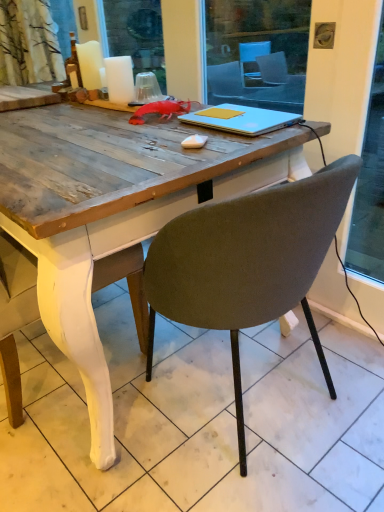
You are a GUI agent. You are given a task and a screenshot of the screen. Output one action in this format:
    pyautogui.click(x=<x>, y=<y>)
    Task: Click on the white matte candle at upper left, which is the 1th candle from front to back
    The height and width of the screenshot is (512, 384).
    Given the screenshot: What is the action you would take?
    pyautogui.click(x=119, y=79)

Measure the distance between white matte candle at upper left, the second candle from the front, and camera.

6.25 feet.

The width and height of the screenshot is (384, 512). Identify the location of silver metallic laptop at center, the 1th notebook in the bottom-to-top sequence. (241, 119).

Between matte gray chair at center and white matte candle at upper left, placed as the 2th candle when sorted from left to right, which one has larger size?

matte gray chair at center is bigger.

Which object is closer to the camera, matte gray chair at center or white matte candle at upper left, placed as the 2th candle when sorted from left to right?

Positioned in front is matte gray chair at center.

Does matte gray chair at center appear on the right side of white matte candle at upper left, which is the 1th candle from front to back?

Yes, matte gray chair at center is to the right of white matte candle at upper left, which is the 1th candle from front to back.

From a real-world perspective, is matte gray chair at center positioned above or below white matte candle at upper left, which is the 1th candle from front to back?

From a real-world perspective, matte gray chair at center is physically below white matte candle at upper left, which is the 1th candle from front to back.

Considering the points (92, 57) and (297, 181), which point is behind, point (92, 57) or point (297, 181)?

Positioned behind is point (92, 57).

Is matte gray chair at center a part of white matte candle at upper left, the second candle from the front?

No, matte gray chair at center is not a part of white matte candle at upper left, the second candle from the front.

How distant is white matte candle at upper left, arranged as the 2th candle when viewed from the right, from matte gray chair at center?

A distance of 4.50 feet exists between white matte candle at upper left, arranged as the 2th candle when viewed from the right, and matte gray chair at center.

From the image's perspective, is white matte candle at upper left, which appears as the 1th candle when viewed from the left, above or below matte gray chair at center?

Clearly, from the image's perspective, white matte candle at upper left, which appears as the 1th candle when viewed from the left, is above matte gray chair at center.

Looking at this image, can you confirm if matte gray chair at center is wider than silver metallic laptop at center, the 1th notebook in the bottom-to-top sequence?

Correct, the width of matte gray chair at center exceeds that of silver metallic laptop at center, the 1th notebook in the bottom-to-top sequence.

Can you tell me how much matte gray chair at center and silver metallic laptop at center, marked as the 2th notebook in a top-to-bottom arrangement, differ in facing direction?

90 degrees separate the facing orientations of matte gray chair at center and silver metallic laptop at center, marked as the 2th notebook in a top-to-bottom arrangement.

Where is `notebook that is the 1st object located above the matte gray chair at center (from the image's perspective)`? The height and width of the screenshot is (512, 384). notebook that is the 1st object located above the matte gray chair at center (from the image's perspective) is located at coordinates tap(241, 119).

Would you say silver metallic laptop at center, marked as the 2th notebook in a top-to-bottom arrangement, is part of matte gray chair at center's contents?

Indeed, silver metallic laptop at center, marked as the 2th notebook in a top-to-bottom arrangement, is located within matte gray chair at center.

Is yellow matte notebook at center, the first notebook when ordered from top to bottom, located outside silver metallic laptop at center, the 1th notebook in the bottom-to-top sequence?

No, yellow matte notebook at center, the first notebook when ordered from top to bottom, is not entirely external to silver metallic laptop at center, the 1th notebook in the bottom-to-top sequence.

In the scene shown: Is yellow matte notebook at center, which is the 2th notebook from bottom to top, at the left side of silver metallic laptop at center, marked as the 2th notebook in a top-to-bottom arrangement?

Correct, you'll find yellow matte notebook at center, which is the 2th notebook from bottom to top, to the left of silver metallic laptop at center, marked as the 2th notebook in a top-to-bottom arrangement.

At what (x,y) coordinates should I click in order to perform the action: click on notebook lying on the right of yellow matte notebook at center, which is the 2th notebook from bottom to top. Please return your answer as a coordinate pair (x, y). Looking at the image, I should click on (241, 119).

Which object is wider, yellow matte notebook at center, the first notebook when ordered from top to bottom, or silver metallic laptop at center, the 1th notebook in the bottom-to-top sequence?

silver metallic laptop at center, the 1th notebook in the bottom-to-top sequence, is wider.

Considering the sizes of objects matte gray chair at center and yellow matte notebook at center, which is the 2th notebook from bottom to top, in the image provided, who is shorter, matte gray chair at center or yellow matte notebook at center, which is the 2th notebook from bottom to top,?

yellow matte notebook at center, which is the 2th notebook from bottom to top.

Is matte gray chair at center at the left side of yellow matte notebook at center, which is the 2th notebook from bottom to top?

No.

Where is `chair in front of the yellow matte notebook at center, the first notebook when ordered from top to bottom`? This screenshot has height=512, width=384. chair in front of the yellow matte notebook at center, the first notebook when ordered from top to bottom is located at coordinates (247, 262).

Does silver metallic laptop at center, the 1th notebook in the bottom-to-top sequence, come behind white matte candle at upper left, which is the first candle from right to left?

No, silver metallic laptop at center, the 1th notebook in the bottom-to-top sequence, is closer to the camera.

From the image's perspective, who appears lower, silver metallic laptop at center, the 1th notebook in the bottom-to-top sequence, or white matte candle at upper left, placed as the 2th candle when sorted from left to right?

From the image's view, silver metallic laptop at center, the 1th notebook in the bottom-to-top sequence, is below.

From a real-world perspective, is silver metallic laptop at center, the 1th notebook in the bottom-to-top sequence, over white matte candle at upper left, the 2th candle when ordered from back to front?

No, from a real-world perspective, silver metallic laptop at center, the 1th notebook in the bottom-to-top sequence, is not on top of white matte candle at upper left, the 2th candle when ordered from back to front.

Is white matte candle at upper left, which is the 1th candle from front to back, not close to silver metallic laptop at center, marked as the 2th notebook in a top-to-bottom arrangement?

Actually, white matte candle at upper left, which is the 1th candle from front to back, and silver metallic laptop at center, marked as the 2th notebook in a top-to-bottom arrangement, are a little close together.

Considering the relative sizes of white matte candle at upper left, the 2th candle when ordered from back to front, and silver metallic laptop at center, marked as the 2th notebook in a top-to-bottom arrangement, in the image provided, is white matte candle at upper left, the 2th candle when ordered from back to front, thinner than silver metallic laptop at center, marked as the 2th notebook in a top-to-bottom arrangement,?

Correct, the width of white matte candle at upper left, the 2th candle when ordered from back to front, is less than that of silver metallic laptop at center, marked as the 2th notebook in a top-to-bottom arrangement.

Locate an element on the screen. the 1st candle counting from the left of the silver metallic laptop at center, the 1th notebook in the bottom-to-top sequence is located at coordinates (119, 79).

Is silver metallic laptop at center, marked as the 2th notebook in a top-to-bottom arrangement, at the back of white matte candle at upper left, the 2th candle when ordered from back to front?

white matte candle at upper left, the 2th candle when ordered from back to front, does not have its back to silver metallic laptop at center, marked as the 2th notebook in a top-to-bottom arrangement.

This screenshot has width=384, height=512. What are the coordinates of `chair in front of the white matte candle at upper left, placed as the 2th candle when sorted from left to right` in the screenshot? It's located at (247, 262).

Identify the location of chair on the right of white matte candle at upper left, arranged as the 2th candle when viewed from the right. The height and width of the screenshot is (512, 384). (247, 262).

Looking at the image, which one is located closer to matte gray chair at center, white matte candle at upper left, the second candle from the front, or yellow matte notebook at center, which is the 2th notebook from bottom to top?

yellow matte notebook at center, which is the 2th notebook from bottom to top, is positioned closer to the anchor matte gray chair at center.

Estimate the real-world distances between objects in this image. Which object is closer to matte gray chair at center, white matte candle at upper left, which is the first candle from right to left, or silver metallic laptop at center, the 1th notebook in the bottom-to-top sequence?

silver metallic laptop at center, the 1th notebook in the bottom-to-top sequence, is positioned closer to the anchor matte gray chair at center.

From the image, which object appears to be nearer to yellow matte notebook at center, which is the 2th notebook from bottom to top, matte gray chair at center or white matte candle at upper left, which is the 1th candle from front to back?

white matte candle at upper left, which is the 1th candle from front to back, lies closer to yellow matte notebook at center, which is the 2th notebook from bottom to top, than the other object.

From the image, which object appears to be farther from yellow matte notebook at center, the first notebook when ordered from top to bottom, silver metallic laptop at center, marked as the 2th notebook in a top-to-bottom arrangement, or white matte candle at upper left, which is the first candle from right to left?

The object further to yellow matte notebook at center, the first notebook when ordered from top to bottom, is white matte candle at upper left, which is the first candle from right to left.

Estimate the real-world distances between objects in this image. Which object is closer to silver metallic laptop at center, the 1th notebook in the bottom-to-top sequence, matte gray chair at center or white matte candle at upper left, the second candle from the front?

Based on the image, matte gray chair at center appears to be nearer to silver metallic laptop at center, the 1th notebook in the bottom-to-top sequence.

Based on the photo, based on their spatial positions, is matte gray chair at center or silver metallic laptop at center, marked as the 2th notebook in a top-to-bottom arrangement, further from white matte candle at upper left, which is the first candle from right to left?

matte gray chair at center lies further to white matte candle at upper left, which is the first candle from right to left, than the other object.

Looking at this image, which object lies further to the anchor point silver metallic laptop at center, the 1th notebook in the bottom-to-top sequence, white matte candle at upper left, which is the first candle from right to left, or white matte candle at upper left, which ranks as the 1th candle in back-to-front order?

Among the two, white matte candle at upper left, which ranks as the 1th candle in back-to-front order, is located further to silver metallic laptop at center, the 1th notebook in the bottom-to-top sequence.

When comparing their distances from yellow matte notebook at center, the first notebook when ordered from top to bottom, does white matte candle at upper left, which is the 1th candle from front to back, or silver metallic laptop at center, the 1th notebook in the bottom-to-top sequence, seem closer?

Based on the image, silver metallic laptop at center, the 1th notebook in the bottom-to-top sequence, appears to be nearer to yellow matte notebook at center, the first notebook when ordered from top to bottom.

Where is `candle situated between white matte candle at upper left, which ranks as the 1th candle in back-to-front order, and yellow matte notebook at center, which is the 2th notebook from bottom to top, from left to right`? candle situated between white matte candle at upper left, which ranks as the 1th candle in back-to-front order, and yellow matte notebook at center, which is the 2th notebook from bottom to top, from left to right is located at coordinates (119, 79).

What are the coordinates of `candle between white matte candle at upper left, arranged as the 2th candle when viewed from the right, and silver metallic laptop at center, marked as the 2th notebook in a top-to-bottom arrangement, in the horizontal direction` in the screenshot? It's located at (119, 79).

The height and width of the screenshot is (512, 384). Find the location of `notebook between white matte candle at upper left, the 2th candle when ordered from back to front, and silver metallic laptop at center, marked as the 2th notebook in a top-to-bottom arrangement`. notebook between white matte candle at upper left, the 2th candle when ordered from back to front, and silver metallic laptop at center, marked as the 2th notebook in a top-to-bottom arrangement is located at coordinates (220, 113).

The height and width of the screenshot is (512, 384). What are the coordinates of `candle between matte gray chair at center and white matte candle at upper left, arranged as the 2th candle when viewed from the right, along the z-axis` in the screenshot? It's located at (119, 79).